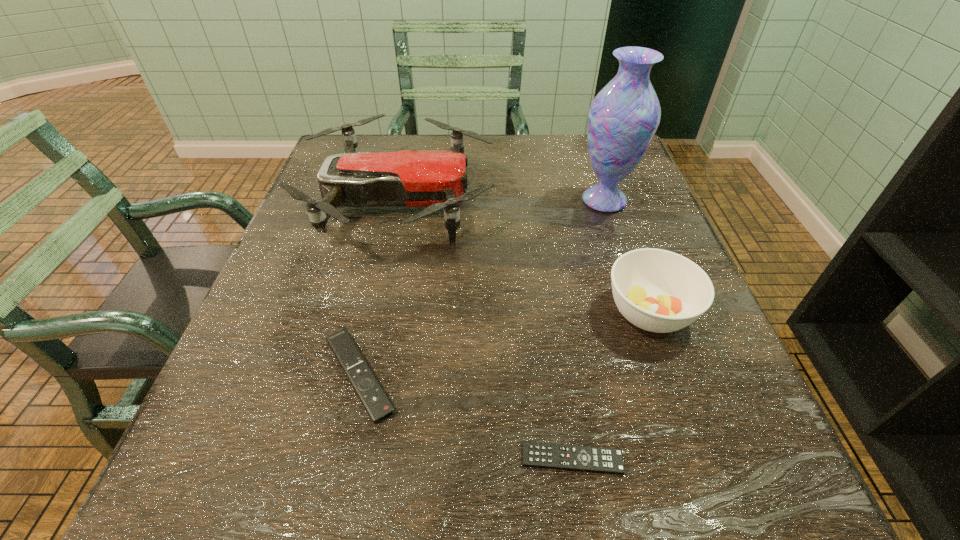
You are a GUI agent. You are given a task and a screenshot of the screen. Output one action in this format:
    pyautogui.click(x=<x>, y=<y>)
    Task: Click on the free spot at the near edge of the desktop
    The width and height of the screenshot is (960, 540).
    Given the screenshot: What is the action you would take?
    pyautogui.click(x=560, y=504)

Find the location of a particular element. free spot at the left edge of the desktop is located at coordinates coord(307,195).

Identify the location of vacant space at the right edge. (639, 204).

I want to click on vacant area between the drone and the shortest object, so click(x=486, y=330).

I want to click on free space between the drone and the left remote control, so click(379, 289).

Locate an element on the screen. Image resolution: width=960 pixels, height=540 pixels. empty space that is in between the tallest object and the shortest object is located at coordinates (588, 329).

Identify the location of free space between the drone and the vase. (502, 201).

Where is `free space between the nearest object and the tallest object`? This screenshot has height=540, width=960. free space between the nearest object and the tallest object is located at coordinates (588, 329).

Identify the location of vacant area between the vase and the drone. The width and height of the screenshot is (960, 540). (502, 201).

Find the location of a particular element. free point between the soup bowl and the drone is located at coordinates (524, 258).